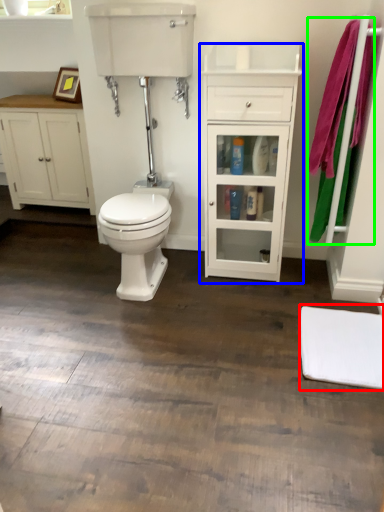
Question: Which object is positioned farthest from mat (highlighted by a red box)? Select from cabinetry (highlighted by a blue box) and bath towel (highlighted by a green box).

Choices:
 (A) cabinetry
 (B) bath towel

Answer: (A)